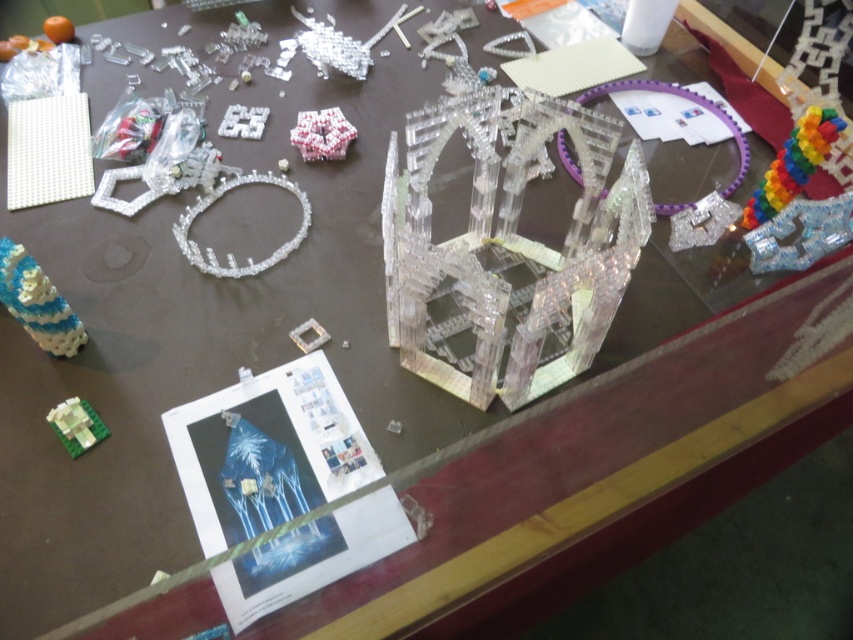
Looking at this image, you are a child who wants to reach the transparent plastic toy at right from your current position at the edge of the table. The table is 3 feet wide. Can you safely extend your hand to grab it without falling off the table?

The transparent plastic toy at right is 3.32 feet away from you. Since the table is only 3 feet wide, your hand would extend beyond the table edge by 0.32 feet, making it unsafe to reach without risking falling off.